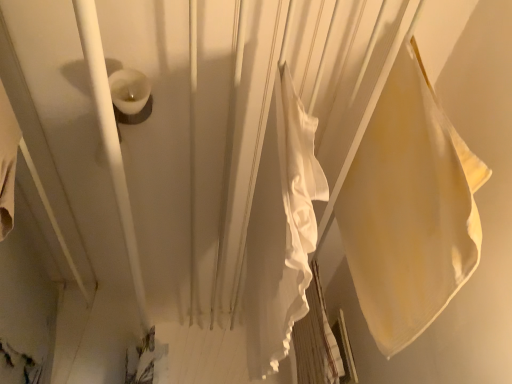
At what (x,y) coordinates should I click in order to perform the action: click on white cotton cloth at right. Please return your answer as a coordinate pair (x, y). Image resolution: width=512 pixels, height=384 pixels. Looking at the image, I should click on (409, 209).

The image size is (512, 384). What do you see at coordinates (409, 209) in the screenshot?
I see `white cotton cloth at right` at bounding box center [409, 209].

Measure the distance between point (369, 282) and camera.

37.64 inches.

This screenshot has height=384, width=512. In order to click on white cotton cloth at right in this screenshot , I will do `click(409, 209)`.